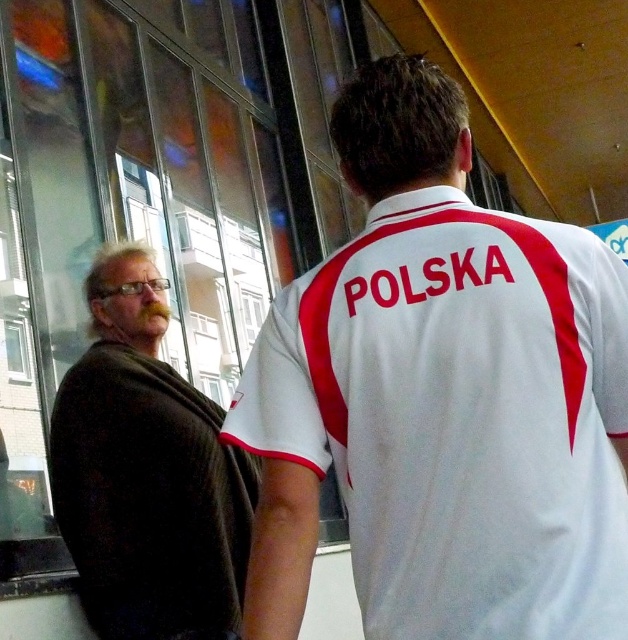
You are an artist trying to paint the scene. You have limited canvas space. Which object should you prioritize to fit both the white fabric shirt at center and the dark brown sweater at left without overcrowding the painting?

You should prioritize painting the dark brown sweater at left first since it occupies more space than the white fabric shirt at center, ensuring it fits properly before adding the smaller one.

You are standing in the scene and want to place a small sticker on the nearest point between the two points labeled point (273, 470) and point (116, 349). Which point should you choose?

Point (273, 470) is closer to the camera than point (116, 349), so you should place the sticker on point (273, 470).

You are a photographer trying to capture both the white fabric shirt at center and the dark brown sweater at left in a single shot. Based on the scene, can you fit both into your camera frame if your camera has a minimum required distance of 28 inches between the closest edges of the subjects?

The white fabric shirt at center and dark brown sweater at left are 27.89 inches apart from each other, which is slightly less than the required 28 inches. Therefore, they cannot be captured in a single shot with this camera.